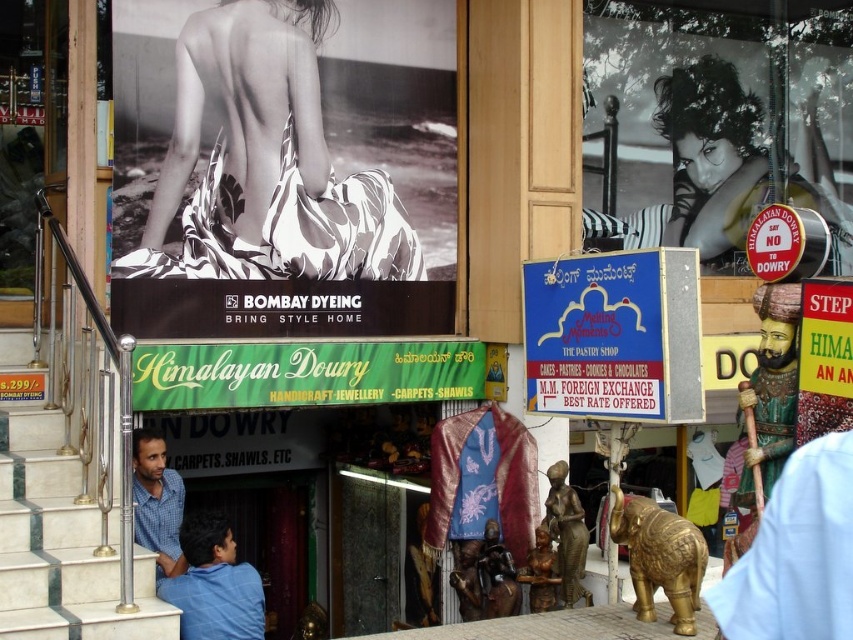
Does white printed fabric at upper center appear on the right side of green fabric signboard at center?

In fact, white printed fabric at upper center is to the left of green fabric signboard at center.

Is white printed fabric at upper center thinner than green fabric signboard at center?

Correct, white printed fabric at upper center's width is less than green fabric signboard at center's.

Between point (227, 180) and point (252, 356), which one is positioned behind?

Point (227, 180)

Identify the location of white printed fabric at upper center. (265, 161).

Between white printed fabric at upper center and brushed metal railing at left, which one is positioned higher?

Positioned higher is brushed metal railing at left.

Can you confirm if white printed fabric at upper center is wider than brushed metal railing at left?

Yes, white printed fabric at upper center is wider than brushed metal railing at left.

What do you see at coordinates (265, 161) in the screenshot? The height and width of the screenshot is (640, 853). I see `white printed fabric at upper center` at bounding box center [265, 161].

Where is `white printed fabric at upper center`? white printed fabric at upper center is located at coordinates (265, 161).

Between black glossy poster at upper right and white marble stairs at lower left, which one appears on the right side from the viewer's perspective?

black glossy poster at upper right

Between point (718, 208) and point (44, 500), which one is positioned behind?

The point (718, 208) is more distant.

Between point (840, 227) and point (16, 497), which one is positioned behind?

Positioned behind is point (840, 227).

The width and height of the screenshot is (853, 640). Identify the location of black glossy poster at upper right. (718, 120).